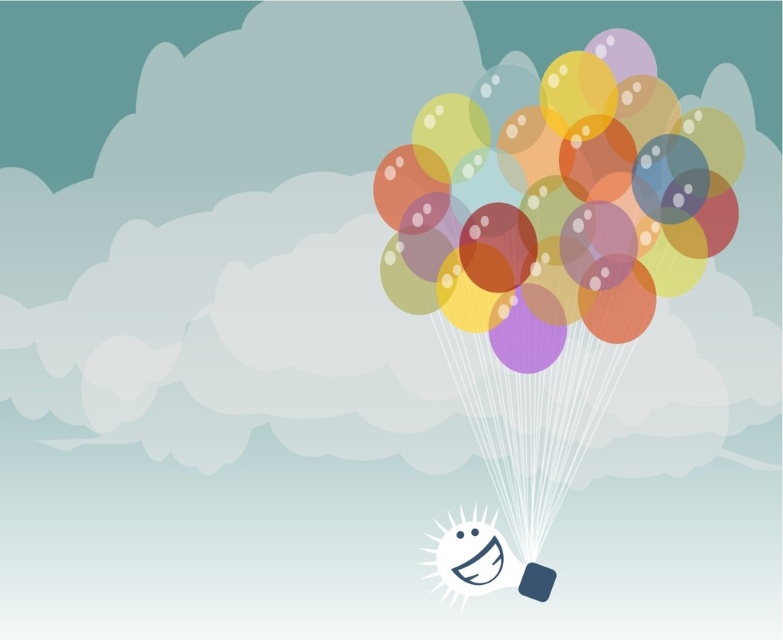
Question: Can you confirm if translucent paper balloons at upper center is positioned above smooth blue square at lower right?

Choices:
 (A) yes
 (B) no

Answer: (A)

Question: Does translucent paper balloons at upper center come behind smooth blue square at lower right?

Choices:
 (A) yes
 (B) no

Answer: (A)

Question: Among these objects, which one is nearest to the camera?

Choices:
 (A) smooth blue square at lower right
 (B) translucent paper balloons at upper center

Answer: (A)

Question: Does translucent paper balloons at upper center have a larger size compared to smooth blue square at lower right?

Choices:
 (A) yes
 (B) no

Answer: (A)

Question: Which object appears farthest from the camera in this image?

Choices:
 (A) smooth blue square at lower right
 (B) translucent paper balloons at upper center

Answer: (B)